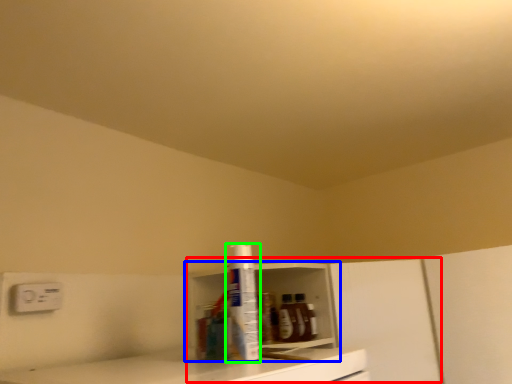
Question: Considering the real-world distances, which object is farthest from cabinetry (highlighted by a red box)? shelf (highlighted by a blue box) or bottle (highlighted by a green box)?

Choices:
 (A) shelf
 (B) bottle

Answer: (B)